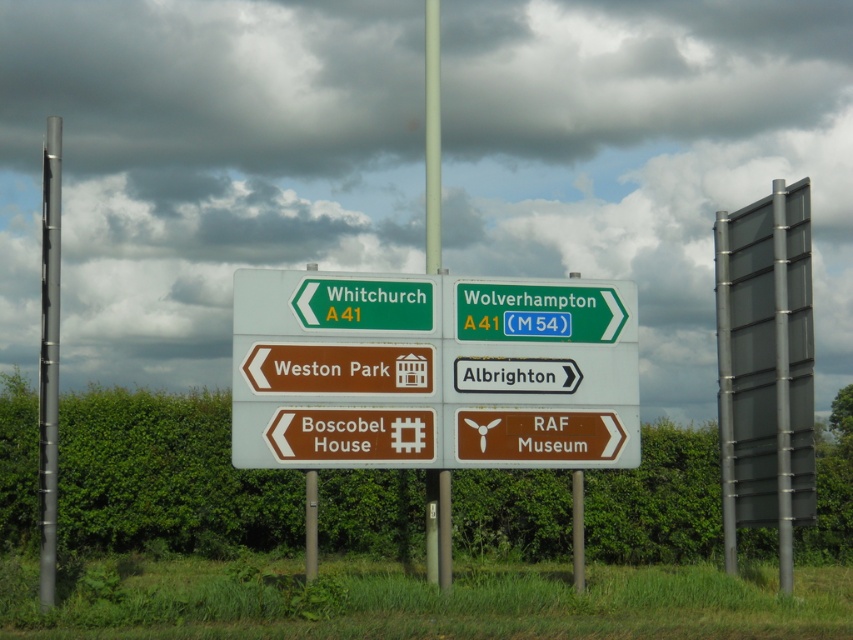
Question: Which object appears closest to the camera in this image?

Choices:
 (A) green matte sign at left
 (B) metallic gray pole at left
 (C) green plastic road sign at center

Answer: (B)

Question: Can you confirm if green plastic sign at upper right is bigger than green matte sign at left?

Choices:
 (A) no
 (B) yes

Answer: (B)

Question: Observing the image, what is the correct spatial positioning of green plastic sign at upper right in reference to metallic pole at center?

Choices:
 (A) below
 (B) above

Answer: (A)

Question: Which object is closer to the camera taking this photo?

Choices:
 (A) green plastic sign at upper right
 (B) metallic gray pole at left
 (C) green plastic road sign at center

Answer: (B)

Question: Does green plastic sign at upper right lie in front of metallic pole at center?

Choices:
 (A) yes
 (B) no

Answer: (B)

Question: Which of the following is the farthest from the observer?

Choices:
 (A) (57, 289)
 (B) (303, 364)
 (C) (323, 292)
 (D) (439, 522)

Answer: (D)